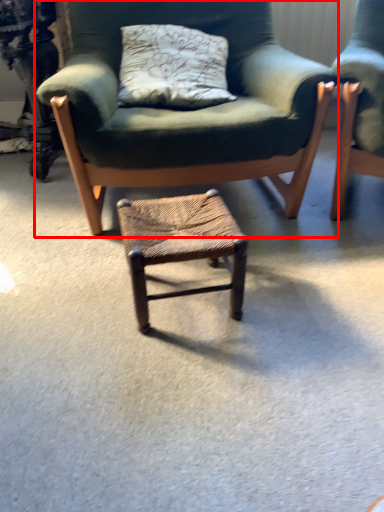
Question: From the image, what is the correct spatial relationship of chair (annotated by the red box) in relation to stool?

Choices:
 (A) left
 (B) right

Answer: (A)